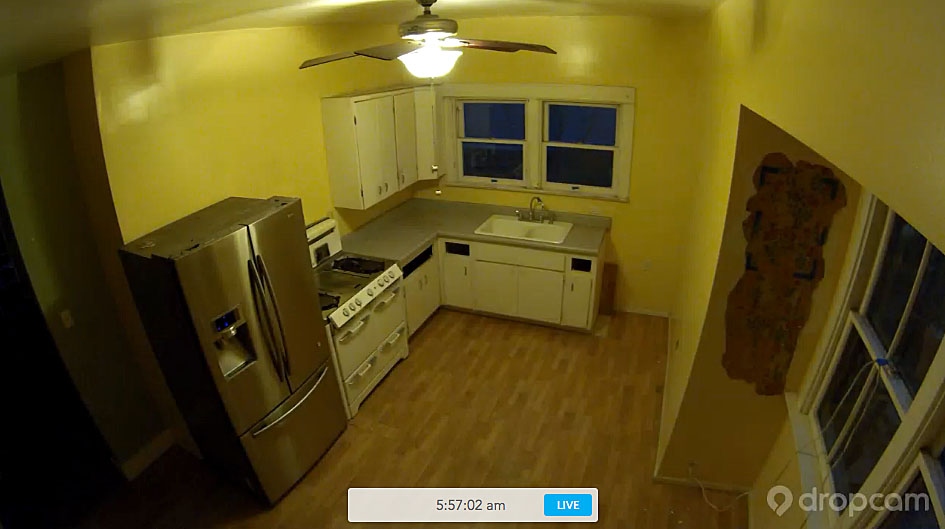
The image size is (945, 529). What are the coordinates of `ceiling fan` in the screenshot? It's located at (427, 36).